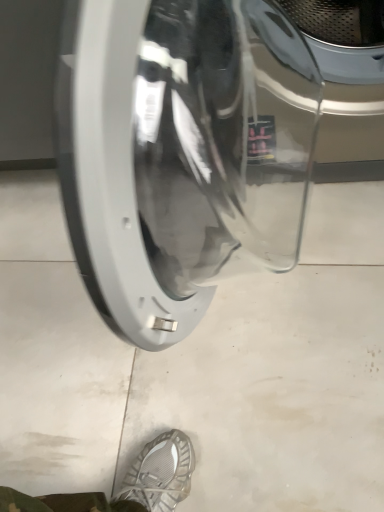
Locate an element on the screen. Image resolution: width=384 pixels, height=512 pixels. sleek metallic washing machine at center is located at coordinates (181, 150).

Describe the element at coordinates (181, 150) in the screenshot. I see `sleek metallic washing machine at center` at that location.

This screenshot has width=384, height=512. Find the location of `sleek metallic washing machine at center`. sleek metallic washing machine at center is located at coordinates (181, 150).